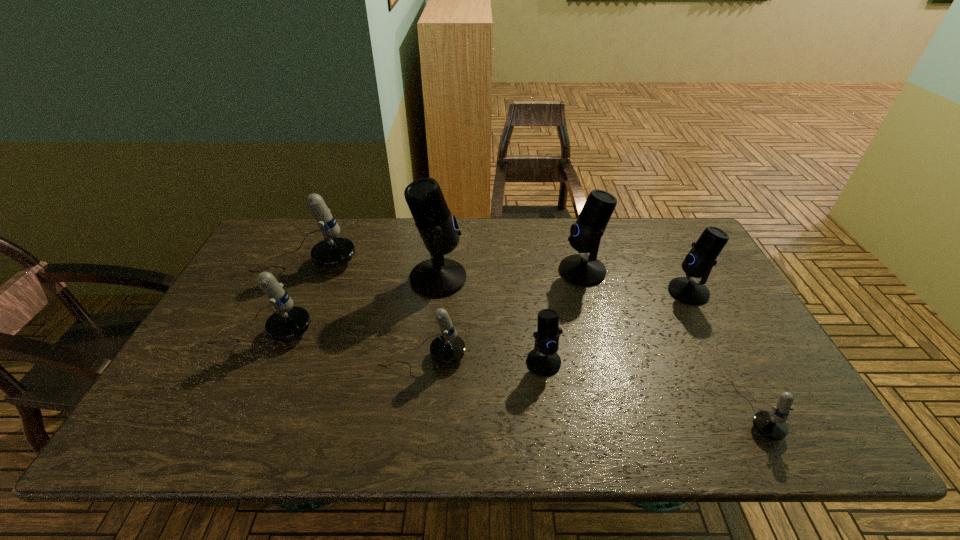
Image resolution: width=960 pixels, height=540 pixels. I want to click on object that is the fifth closest one to the third smallest white microphone, so click(x=582, y=269).

Where is `object that is the closest to the third object from right to left`? The width and height of the screenshot is (960, 540). object that is the closest to the third object from right to left is located at coordinates (701, 258).

Where is `microphone that can be found as the fourth closest to the second biggest white microphone`? The height and width of the screenshot is (540, 960). microphone that can be found as the fourth closest to the second biggest white microphone is located at coordinates (543, 360).

Choose which microphone is the fifth nearest neighbor to the tallest microphone. Please provide its 2D coordinates. Your answer should be formatted as a tuple, i.e. [(x, y)], where the tuple contains the x and y coordinates of a point satisfying the conditions above.

[(582, 269)]

Identify which black microphone is located as the third nearest to the second smallest black microphone. Please provide its 2D coordinates. Your answer should be formatted as a tuple, i.e. [(x, y)], where the tuple contains the x and y coordinates of a point satisfying the conditions above.

[(437, 277)]

Identify the location of black microphone that is the third closest to the third white microphone from left to right. (582, 269).

You are a GUI agent. You are given a task and a screenshot of the screen. Output one action in this format:
    pyautogui.click(x=<x>, y=<y>)
    Task: Click on the white microphone that is the third closest one to the third black microphone from left to right
    This screenshot has height=540, width=960.
    Given the screenshot: What is the action you would take?
    pyautogui.click(x=334, y=251)

Where is `white microphone object that ranks as the second closest to the nearest white microphone`? white microphone object that ranks as the second closest to the nearest white microphone is located at coordinates (288, 322).

At what (x,y) coordinates should I click in order to perform the action: click on free space that satisfies the following two spatial constraints: 1. on the stand of the nearest object; 2. on the right side of the third smallest black microphone. Please return your answer as a coordinate pair (x, y). The width and height of the screenshot is (960, 540). Looking at the image, I should click on (620, 411).

Find the location of a particular element. The width and height of the screenshot is (960, 540). vacant point that satisfies the following two spatial constraints: 1. on the stand of the tallest microphone; 2. on the front side of the second white microphone from right to left is located at coordinates (430, 356).